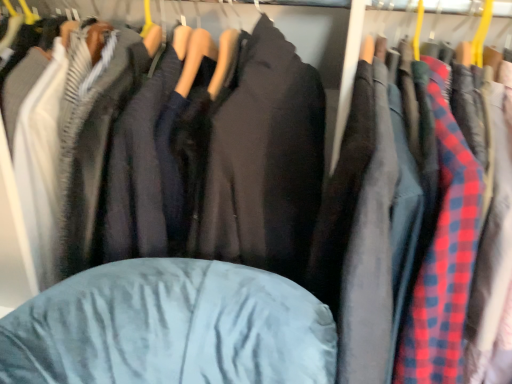
The height and width of the screenshot is (384, 512). Find the location of `velvet blue bean bag at center`. velvet blue bean bag at center is located at coordinates 170,327.

Measure the distance between velvet blue jacket at center and camera.

The distance of velvet blue jacket at center from camera is 26.50 inches.

Describe the element at coordinates (443, 261) in the screenshot. I see `red plaid shirt at center` at that location.

At what (x,y) coordinates should I click in order to perform the action: click on velvet blue bean bag at center. Please return your answer as a coordinate pair (x, y). This screenshot has height=384, width=512. Looking at the image, I should click on (170, 327).

Are velvet blue bean bag at center and velvet blue jacket at center far apart?

No, velvet blue bean bag at center is in close proximity to velvet blue jacket at center.

Where is `bean bag chair directly beneath the velvet blue jacket at center (from a real-world perspective)`? The width and height of the screenshot is (512, 384). bean bag chair directly beneath the velvet blue jacket at center (from a real-world perspective) is located at coordinates (170, 327).

From the image's perspective, is velvet blue bean bag at center positioned above or below velvet blue jacket at center?

Clearly, from the image's perspective, velvet blue bean bag at center is below velvet blue jacket at center.

Does velvet blue bean bag at center come behind velvet blue jacket at center?

No, the depth of velvet blue bean bag at center is less than that of velvet blue jacket at center.

Between red plaid shirt at center and velvet blue jacket at center, which one has smaller width?

red plaid shirt at center.

Who is taller, red plaid shirt at center or velvet blue jacket at center?

Standing taller between the two is red plaid shirt at center.

From a real-world perspective, which is physically above, red plaid shirt at center or velvet blue jacket at center?

velvet blue jacket at center, from a real-world perspective.

Locate an element on the screen. Image resolution: width=512 pixels, height=384 pixels. clothing below the velvet blue jacket at center (from the image's perspective) is located at coordinates tap(443, 261).

Does point (144, 331) lie in front of point (452, 145)?

No, it is behind (452, 145).

Is velvet blue bean bag at center inside the boundaries of red plaid shirt at center, or outside?

velvet blue bean bag at center is not inside red plaid shirt at center, it's outside.

This screenshot has width=512, height=384. In the image, there is a red plaid shirt at center. Find the location of `bean bag chair below it (from a real-world perspective)`. bean bag chair below it (from a real-world perspective) is located at coordinates (170, 327).

From the image's perspective, is velvet blue bean bag at center positioned above or below red plaid shirt at center?

From the image's perspective, velvet blue bean bag at center appears below red plaid shirt at center.

From a real-world perspective, is velvet blue jacket at center above or below velvet blue bean bag at center?

velvet blue jacket at center is situated higher than velvet blue bean bag at center in the real world.

Is velvet blue bean bag at center at the back of velvet blue jacket at center?

No, velvet blue jacket at center is not facing the opposite direction of velvet blue bean bag at center.

From the image's perspective, is red plaid shirt at center on top of velvet blue bean bag at center?

Correct, red plaid shirt at center appears higher than velvet blue bean bag at center in the image.

From the picture: Considering the positions of objects red plaid shirt at center and velvet blue bean bag at center in the image provided, who is more to the left, red plaid shirt at center or velvet blue bean bag at center?

velvet blue bean bag at center.

Does red plaid shirt at center turn towards velvet blue bean bag at center?

No, red plaid shirt at center is not turned towards velvet blue bean bag at center.

How many degrees apart are the facing directions of velvet blue jacket at center and red plaid shirt at center?

1.25e-05 degrees separate the facing orientations of velvet blue jacket at center and red plaid shirt at center.

From the image's perspective, which one is positioned higher, velvet blue jacket at center or red plaid shirt at center?

From the image's view, velvet blue jacket at center is above.

Is velvet blue jacket at center further to camera compared to red plaid shirt at center?

Yes, velvet blue jacket at center is further from the camera.

Looking at their sizes, would you say velvet blue jacket at center is wider or thinner than red plaid shirt at center?

Considering their sizes, velvet blue jacket at center looks broader than red plaid shirt at center.

Where is `bean bag chair that appears below the velvet blue jacket at center (from the image's perspective)`? Image resolution: width=512 pixels, height=384 pixels. bean bag chair that appears below the velvet blue jacket at center (from the image's perspective) is located at coordinates (170, 327).

At what (x,y) coordinates should I click in order to perform the action: click on jacket above the red plaid shirt at center (from the image's perspective). Please return your answer as a coordinate pair (x, y). Looking at the image, I should click on [x=234, y=167].

Looking at the image, which one is located further to velvet blue bean bag at center, red plaid shirt at center or velvet blue jacket at center?

Among the two, red plaid shirt at center is located further to velvet blue bean bag at center.

From the image, which object appears to be nearer to velvet blue bean bag at center, velvet blue jacket at center or red plaid shirt at center?

velvet blue jacket at center is closer to velvet blue bean bag at center.

Based on their spatial positions, is red plaid shirt at center or velvet blue bean bag at center further from velvet blue jacket at center?

red plaid shirt at center is further to velvet blue jacket at center.

When comparing their distances from red plaid shirt at center, does velvet blue jacket at center or velvet blue bean bag at center seem further?

velvet blue jacket at center lies further to red plaid shirt at center than the other object.

When comparing their distances from velvet blue jacket at center, does velvet blue bean bag at center or red plaid shirt at center seem closer?

velvet blue bean bag at center lies closer to velvet blue jacket at center than the other object.

Looking at this image, from the image, which object appears to be farther from red plaid shirt at center, velvet blue bean bag at center or velvet blue jacket at center?

velvet blue jacket at center is positioned further to the anchor red plaid shirt at center.

The height and width of the screenshot is (384, 512). I want to click on bean bag chair between velvet blue jacket at center and red plaid shirt at center, so click(170, 327).